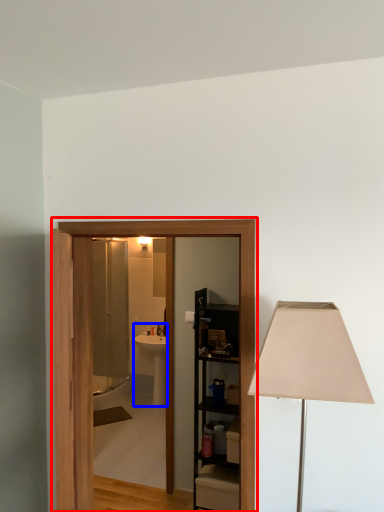
Question: Which point is closer to the camera, barn door (highlighted by a red box) or sink (highlighted by a blue box)?

Choices:
 (A) barn door
 (B) sink

Answer: (A)